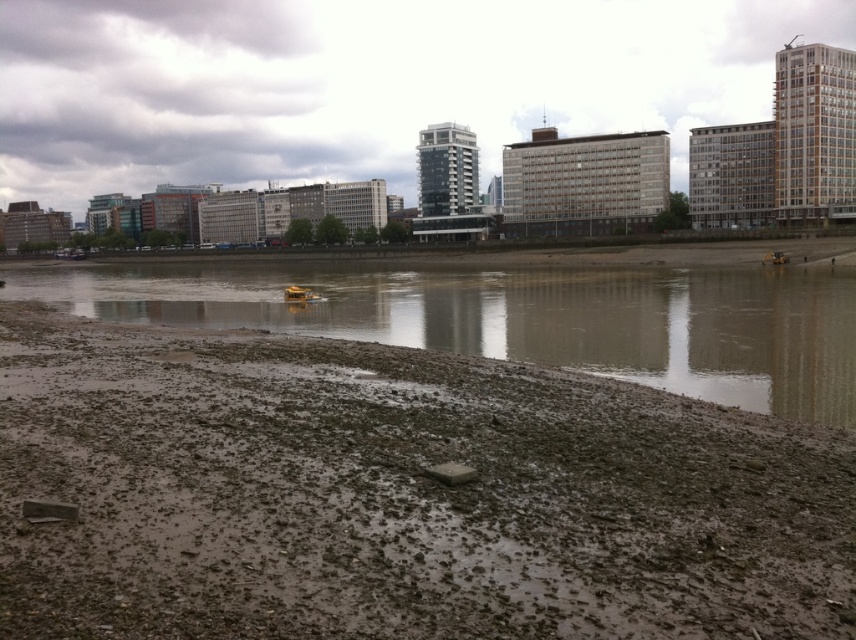
In the scene shown: You are a construction worker needing to cross from the muddy wet ground at lower left to the muddy sand at lower left. The safety regulations state that the distance between two safe points must be less than 50 meters for a direct walk. Can you safely walk directly between them?

The distance between the muddy wet ground at lower left and the muddy sand at lower left is 51.41 meters, which exceeds the 50 meters safety regulation. Therefore, you cannot safely walk directly between them.